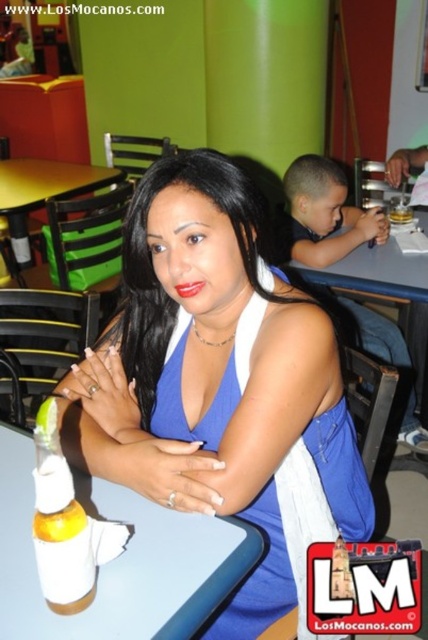
You are a server in a restaurant and need to place a 1.2 meter long tray on the smooth plastic table at center. Considering the distance between the black silky hair at center and the table, will the tray fit without touching the hair?

The distance between the black silky hair at center and the smooth plastic table at center is 1.09 meters. Since the tray is 1.2 meters long, it will extend beyond the available space, causing it to touch the hair. Therefore, the tray cannot be placed safely.